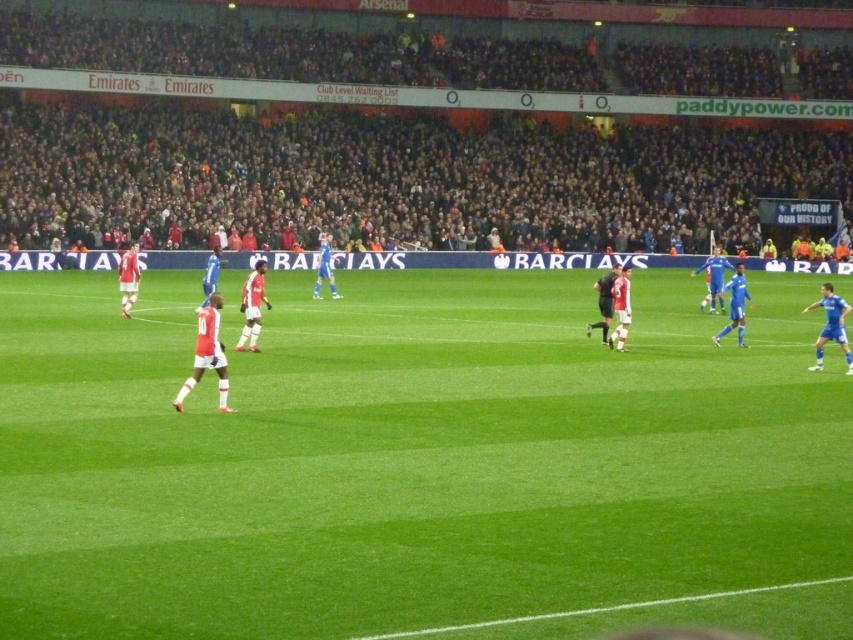
Question: Does green grass field at center appear over dark gray crowd at upper center?

Choices:
 (A) yes
 (B) no

Answer: (B)

Question: Which of the following is the farthest from the observer?

Choices:
 (A) tap(294, 65)
 (B) tap(456, 308)

Answer: (A)

Question: Does green grass field at center have a smaller size compared to dark gray crowd at upper center?

Choices:
 (A) yes
 (B) no

Answer: (A)

Question: Is the position of green grass field at center more distant than that of dark gray crowd at upper center?

Choices:
 (A) no
 (B) yes

Answer: (A)

Question: Which point is farther from the camera taking this photo?

Choices:
 (A) (328, 582)
 (B) (775, 154)

Answer: (B)